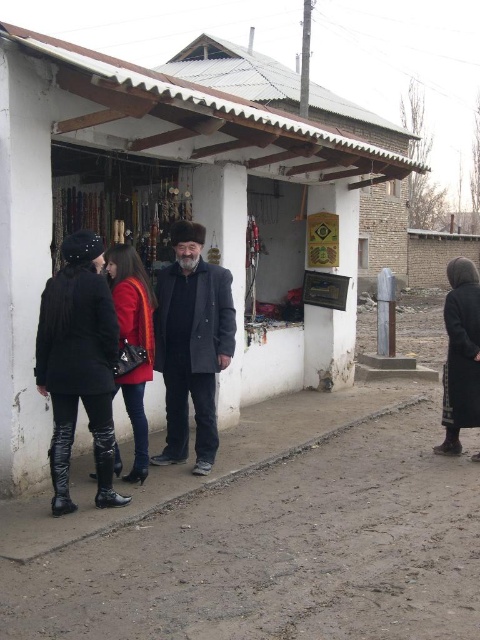
Is black leather boots at lower left shorter than red leather boots at center?

Incorrect, black leather boots at lower left's height does not fall short of red leather boots at center's.

Which is above, black leather boots at lower left or red leather boots at center?

red leather boots at center

Who is more distant from viewer, (76, 369) or (147, 300)?

The point (147, 300) is more distant.

The height and width of the screenshot is (640, 480). What are the coordinates of `black leather boots at lower left` in the screenshot? It's located at (79, 364).

Can you confirm if black leather boots at lower left is positioned below dark gray wool coat at center?

Indeed, black leather boots at lower left is positioned under dark gray wool coat at center.

In the scene shown: Can you confirm if black leather boots at lower left is smaller than dark gray wool coat at center?

Yes.

Find the location of a particular element. black leather boots at lower left is located at coordinates (79, 364).

Describe the element at coordinates (79, 364) in the screenshot. I see `black leather boots at lower left` at that location.

Between black leather boots at lower left and dark gray wool coat at right, which one has less height?

With less height is black leather boots at lower left.

At what (x,y) coordinates should I click in order to perform the action: click on black leather boots at lower left. Please return your answer as a coordinate pair (x, y). Looking at the image, I should click on (79, 364).